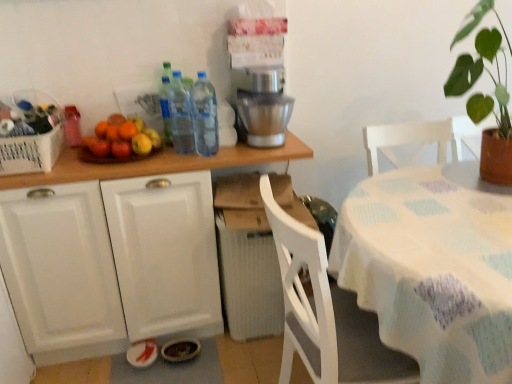
Identify the location of free space to the left of transparent plastic bottle at center, the third bottle viewed from the left. This screenshot has height=384, width=512. (174, 158).